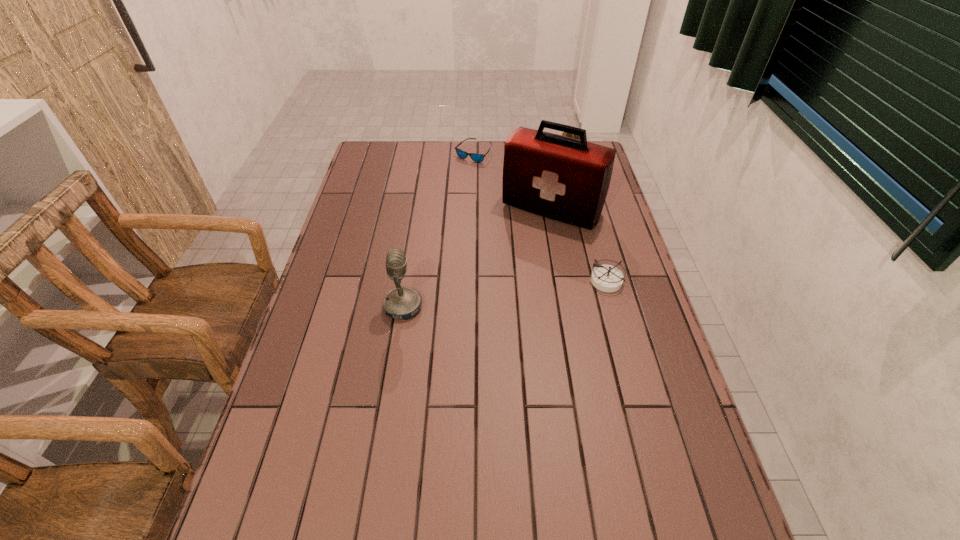
Where is `vacant space located on the front-facing side of the second tallest object`? The height and width of the screenshot is (540, 960). vacant space located on the front-facing side of the second tallest object is located at coordinates (564, 306).

At what (x,y) coordinates should I click in order to perform the action: click on vacant space located 0.250m on the back of the shorter compass. Please return your answer as a coordinate pair (x, y). This screenshot has height=540, width=960. Looking at the image, I should click on (590, 217).

Where is `vacant area situated at the front of the second object from left to right showing the lenses`? The image size is (960, 540). vacant area situated at the front of the second object from left to right showing the lenses is located at coordinates (489, 203).

You are a GUI agent. You are given a task and a screenshot of the screen. Output one action in this format:
    pyautogui.click(x=<x>, y=<y>)
    Task: Click on the vacant space located at the front of the second object from left to right showing the lenses
    
    Given the screenshot: What is the action you would take?
    pyautogui.click(x=482, y=181)

Locate an element on the screen. Image resolution: width=960 pixels, height=540 pixels. vacant space situated at the front of the second object from left to right showing the lenses is located at coordinates (482, 181).

Where is `free space located 0.180m on the side of the tallest object with the cross symbol`? The width and height of the screenshot is (960, 540). free space located 0.180m on the side of the tallest object with the cross symbol is located at coordinates (508, 266).

Where is `vacant area situated 0.250m on the side of the tallest object with the cross symbol`? vacant area situated 0.250m on the side of the tallest object with the cross symbol is located at coordinates (498, 281).

The height and width of the screenshot is (540, 960). In order to click on vacant space located 0.260m on the side of the tallest object with the cross symbol in this screenshot , I will do `click(496, 284)`.

Identify the location of vacant area located 0.160m with the dial facing the third shortest object. (552, 184).

This screenshot has width=960, height=540. Identify the location of free space located with the dial facing the third shortest object. (551, 186).